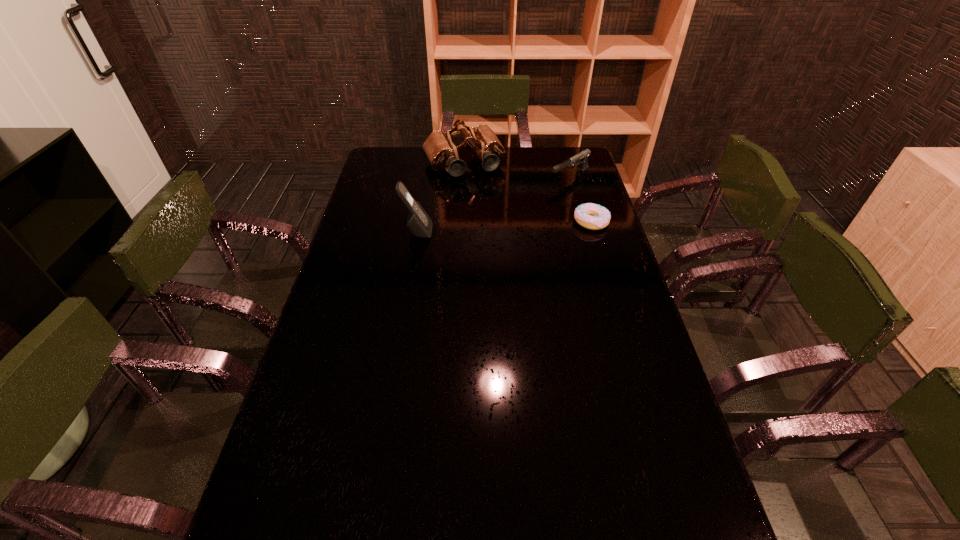
Find the location of a particular element. This screenshot has height=540, width=960. cellular telephone is located at coordinates (418, 222).

Find the location of `doughnut`. doughnut is located at coordinates (592, 216).

At what (x,y) coordinates should I click in order to perform the action: click on binoculars. Please return your answer as a coordinate pair (x, y). Image resolution: width=960 pixels, height=540 pixels. Looking at the image, I should click on [x=441, y=152].

Find the location of a particular element. The height and width of the screenshot is (540, 960). the third tallest object is located at coordinates (582, 157).

At what (x,y) coordinates should I click in order to perform the action: click on vacant space located 0.370m on the front-facing side of the cellular telephone. Please return your answer as a coordinate pair (x, y). This screenshot has width=960, height=540. Looking at the image, I should click on (538, 232).

I want to click on blank area located 0.290m on the back of the doughnut, so click(x=576, y=171).

Identify the location of free space located through the eyepieces of the binoculars. The width and height of the screenshot is (960, 540). (504, 232).

Identify the location of vacant position located 0.260m through the eyepieces of the binoculars. The width and height of the screenshot is (960, 540). (497, 220).

This screenshot has width=960, height=540. In order to click on free spot located through the eyepieces of the binoculars in this screenshot , I will do `click(493, 214)`.

The width and height of the screenshot is (960, 540). I want to click on free spot located at the muzzle end of the second shortest object, so click(491, 221).